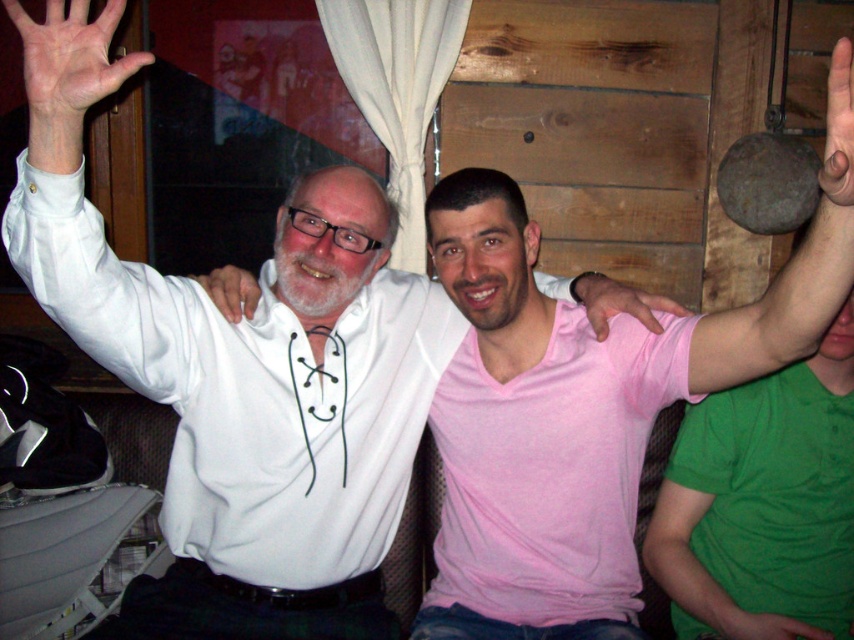
You are standing in the room and want to move from the point at coordinates point (793, 304) to the point at coordinates point (9, 102). Which direction should you move in?

You should move backward because point (793, 304) is in front of point (9, 102), so moving backward will take you toward the latter point.

You are a photographer standing 1 meter away from the three people in the image. You want to take a photo of the matte gray ball at upper right without including any of the three people in the frame. Is this possible given their current positions?

The three people are 92.93 centimeters apart from each other. Since you are standing 1 meter away from them, the distance between you and the ball is likely greater than the space occupied by the people, so it might be possible to position the camera in a way that captures the matte gray ball at upper right while avoiding the individuals. However, exact feasibility depends on the ball and people positioning in the scene.

You are a photographer trying to capture a photo of the three friends. You notice the matte gray ball at upper right and the white matte hand at upper left in the frame. To ensure both objects are in focus, you need to know their vertical positions. Which one is lower in the image?

The matte gray ball at upper right is located below the white matte hand at upper left, so the matte gray ball at upper right is lower in the image.